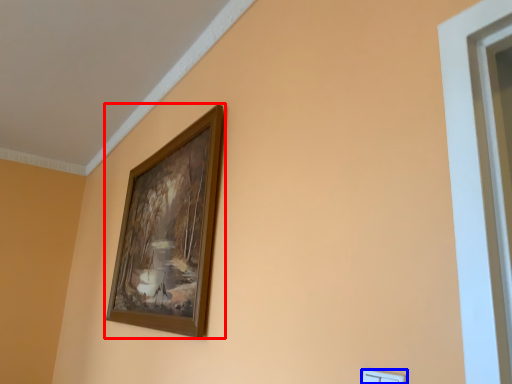
Question: Among these objects, which one is nearest to the camera, picture frame (highlighted by a red box) or light switch (highlighted by a blue box)?

Choices:
 (A) picture frame
 (B) light switch

Answer: (B)